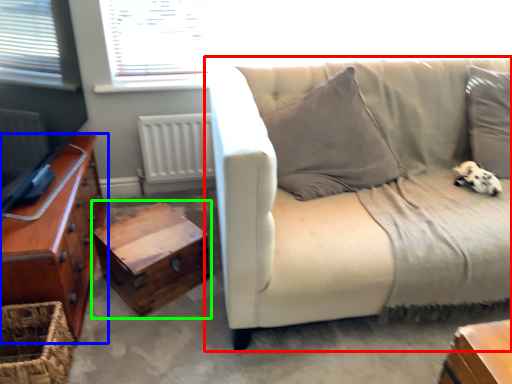
Question: Which object is the closest to the studio couch (highlighted by a red box)? Choose among these: chest of drawers (highlighted by a blue box) or table (highlighted by a green box).

Choices:
 (A) chest of drawers
 (B) table

Answer: (B)